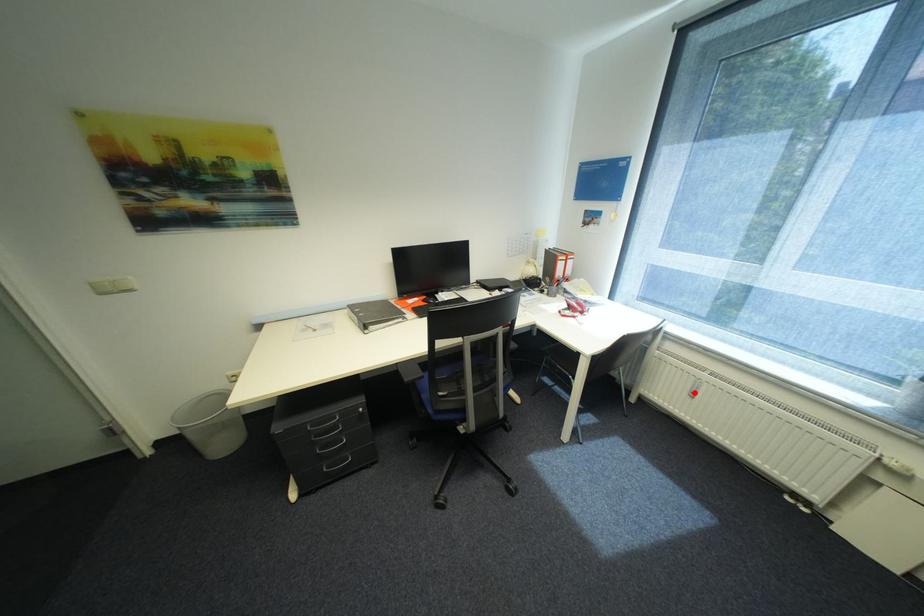
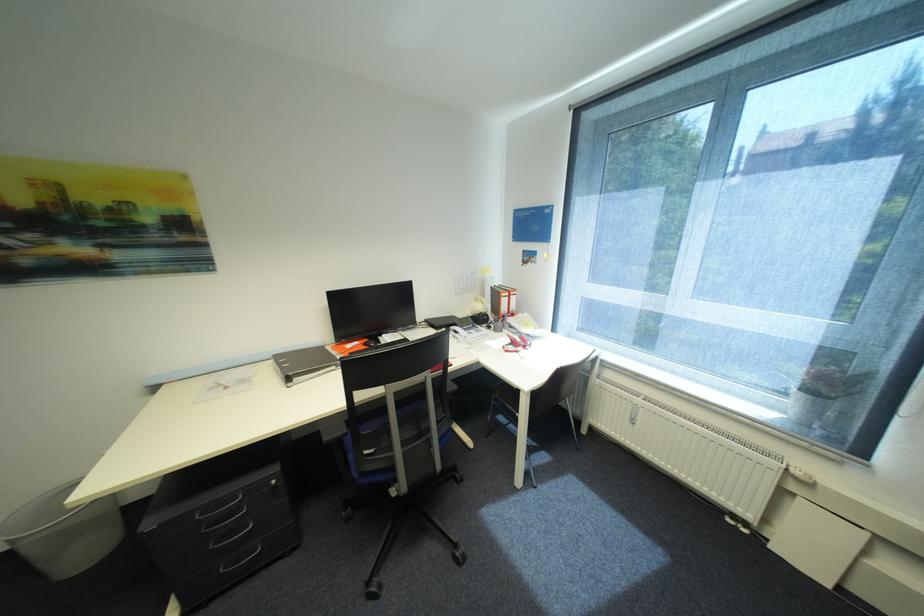
Locate, in the second image, the point that corresponds to the highlighted location in the first image.

(636, 419)